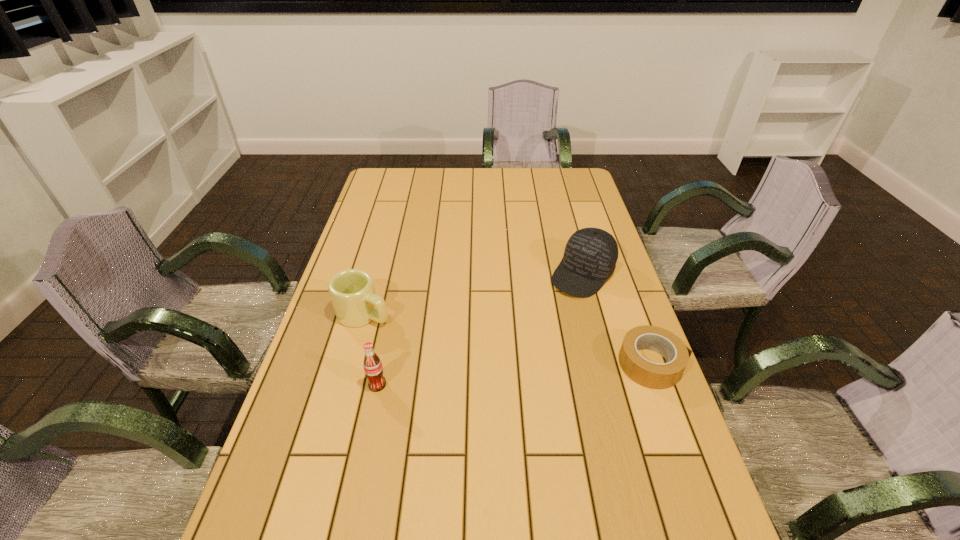
You are a GUI agent. You are given a task and a screenshot of the screen. Output one action in this format:
    pyautogui.click(x=<x>, y=<y>)
    Task: Click on the free space on the desktop that is between the soda and the duct tape and is positioned with the handle on the side of the second shortest object
    The width and height of the screenshot is (960, 540).
    Given the screenshot: What is the action you would take?
    pyautogui.click(x=495, y=376)

This screenshot has width=960, height=540. I want to click on vacant space on the desktop that is between the soda and the shortest object and is positioned at the front of the baseball cap where the brim is located, so click(x=490, y=376).